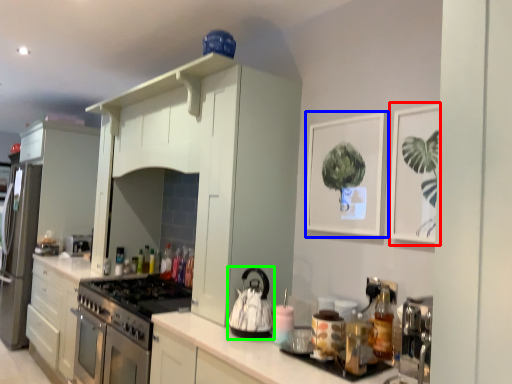
Question: Which object is the closest to the picture frame (highlighted by a red box)? Choose among these: picture frame (highlighted by a blue box) or kitchen appliance (highlighted by a green box).

Choices:
 (A) picture frame
 (B) kitchen appliance

Answer: (A)